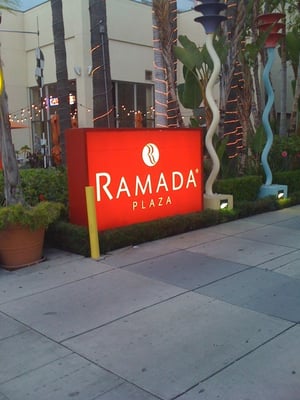
You are a GUI agent. You are given a task and a screenshot of the screen. Output one action in this format:
    pyautogui.click(x=<x>, y=<y>)
    Task: Click on the windows
    This screenshot has width=300, height=400.
    Given the screenshot: What is the action you would take?
    pyautogui.click(x=132, y=90), pyautogui.click(x=53, y=90)